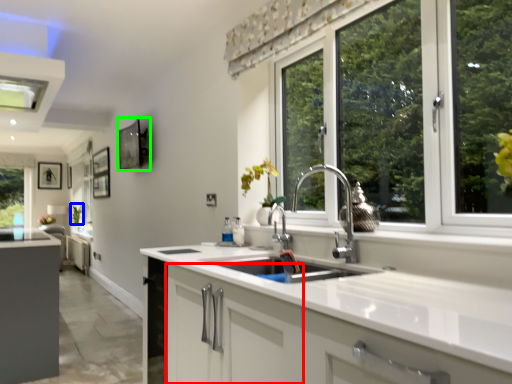
Question: Estimate the real-world distances between objects in this image. Which object is farther from cabinetry (highlighted by a red box), plant (highlighted by a blue box) or picture frame (highlighted by a green box)?

Choices:
 (A) plant
 (B) picture frame

Answer: (A)